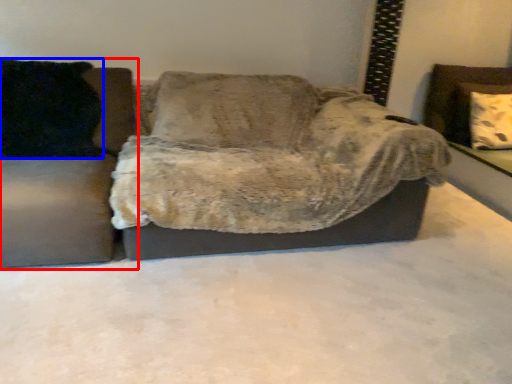
Question: Which point is further to the camera, studio couch (highlighted by a red box) or pillow (highlighted by a blue box)?

Choices:
 (A) studio couch
 (B) pillow

Answer: (B)